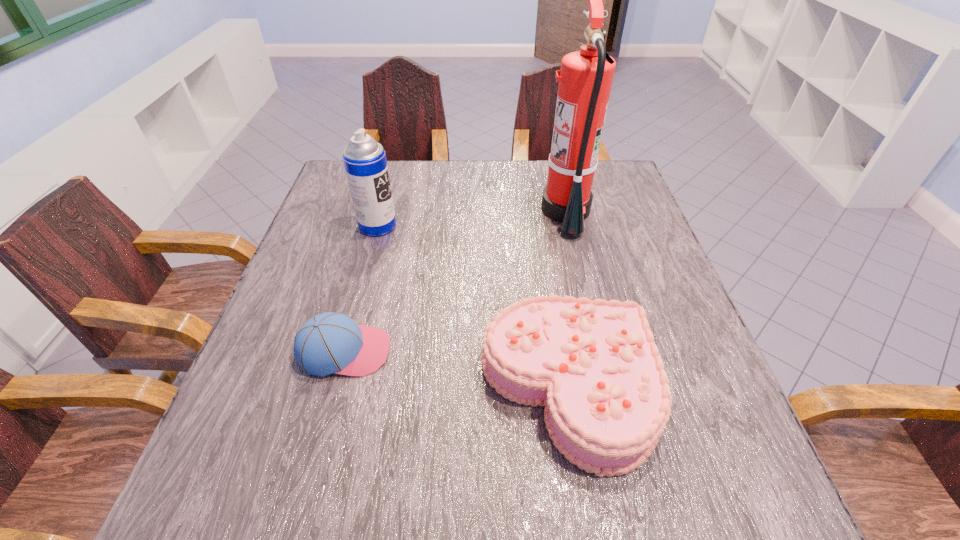
Find the location of a particular element. Image resolution: width=960 pixels, height=540 pixels. free area in between the baseball cap and the third shortest object is located at coordinates (361, 288).

Locate an element on the screen. The height and width of the screenshot is (540, 960). free space between the third shortest object and the baseball cap is located at coordinates (361, 288).

The width and height of the screenshot is (960, 540). Find the location of `vacant space in between the aerosol can and the cake`. vacant space in between the aerosol can and the cake is located at coordinates (473, 307).

Find the location of a particular element. vacant space that is in between the aerosol can and the tallest object is located at coordinates (472, 218).

What are the coordinates of `vacant space that is in between the aerosol can and the cake` in the screenshot? It's located at (x=473, y=307).

Select which object appears as the third closest to the cake. Please provide its 2D coordinates. Your answer should be formatted as a tuple, i.e. [(x, y)], where the tuple contains the x and y coordinates of a point satisfying the conditions above.

[(365, 163)]

Locate which object ranks second in proximity to the tallest object. Please provide its 2D coordinates. Your answer should be formatted as a tuple, i.e. [(x, y)], where the tuple contains the x and y coordinates of a point satisfying the conditions above.

[(365, 163)]

This screenshot has width=960, height=540. In order to click on blank space that satisfies the following two spatial constraints: 1. on the label side of the cake; 2. on the right side of the second tallest object in this screenshot , I will do `click(334, 388)`.

I want to click on free region that satisfies the following two spatial constraints: 1. on the label side of the cake; 2. on the right side of the aerosol can, so click(x=334, y=388).

Where is `vacant position in the image that satisfies the following two spatial constraints: 1. on the front-facing side of the cake; 2. on the left side of the baseball cap`? This screenshot has width=960, height=540. vacant position in the image that satisfies the following two spatial constraints: 1. on the front-facing side of the cake; 2. on the left side of the baseball cap is located at coordinates (335, 388).